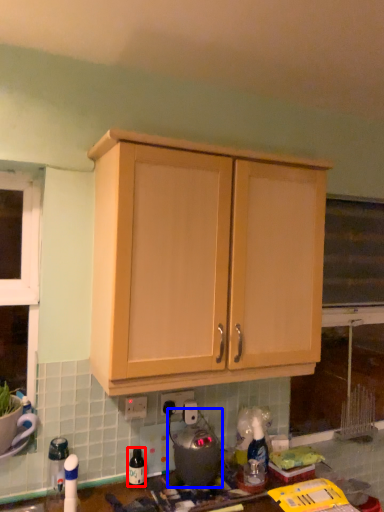
Question: Among these objects, which one is nearest to the camera, bottle (highlighted by a red box) or appliance (highlighted by a blue box)?

Choices:
 (A) bottle
 (B) appliance

Answer: (B)